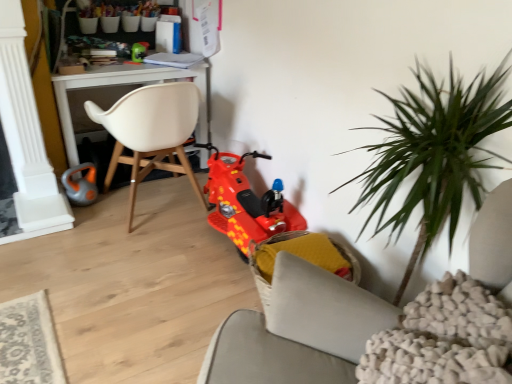
Question: Is orange rubber toy at lower left, arranged as the first toy when viewed from the left, further to camera compared to yellow fabric chair at lower center, which appears as the 1th chair when ordered from the bottom?

Choices:
 (A) no
 (B) yes

Answer: (B)

Question: Is yellow fabric chair at lower center, which appears as the 1th chair when ordered from the bottom, located within orange rubber toy at lower left, arranged as the first toy when viewed from the left?

Choices:
 (A) no
 (B) yes

Answer: (A)

Question: From the image's perspective, is orange rubber toy at lower left, placed as the 2th toy when sorted from top to bottom, on top of yellow fabric chair at lower center, which appears as the 1th chair when ordered from the bottom?

Choices:
 (A) yes
 (B) no

Answer: (A)

Question: Is orange rubber toy at lower left, arranged as the first toy when viewed from the left, oriented towards yellow fabric chair at lower center, the second chair when ordered from top to bottom?

Choices:
 (A) no
 (B) yes

Answer: (B)

Question: Can you confirm if orange rubber toy at lower left, which appears as the 2th toy when ordered from the bottom, is positioned to the right of yellow fabric chair at lower center, the 1th chair from the right?

Choices:
 (A) no
 (B) yes

Answer: (A)

Question: From a real-world perspective, is orange rubber toy at lower left, placed as the 2th toy when sorted from top to bottom, positioned above or below white plastic desk at upper left?

Choices:
 (A) above
 (B) below

Answer: (B)

Question: Would you say orange rubber toy at lower left, placed as the 2th toy when sorted from top to bottom, is to the left or to the right of white plastic desk at upper left in the picture?

Choices:
 (A) left
 (B) right

Answer: (A)

Question: Based on their sizes in the image, would you say orange rubber toy at lower left, arranged as the first toy when viewed from the left, is bigger or smaller than white plastic desk at upper left?

Choices:
 (A) big
 (B) small

Answer: (B)

Question: From the image's perspective, is orange rubber toy at lower left, arranged as the first toy when viewed from the left, located above or below white plastic desk at upper left?

Choices:
 (A) below
 (B) above

Answer: (A)

Question: Based on their positions, is white matte chair at center, arranged as the 2th chair when ordered from the bottom, located to the left or right of shiny plastic scooter at center, the first toy from the bottom?

Choices:
 (A) left
 (B) right

Answer: (A)

Question: Is white matte chair at center, arranged as the 2th chair when ordered from the bottom, bigger or smaller than shiny plastic scooter at center, which appears as the 3th toy when viewed from the left?

Choices:
 (A) small
 (B) big

Answer: (B)

Question: From a real-world perspective, is white matte chair at center, arranged as the 2th chair when ordered from the bottom, physically located above or below shiny plastic scooter at center, the first toy from the bottom?

Choices:
 (A) below
 (B) above

Answer: (B)

Question: In terms of height, does white matte chair at center, marked as the 1th chair in a left-to-right arrangement, look taller or shorter compared to shiny plastic scooter at center, which appears as the 3th toy when viewed from the top?

Choices:
 (A) tall
 (B) short

Answer: (A)

Question: Is shiny plastic scooter at center, which appears as the 3th toy when viewed from the top, bigger or smaller than white plastic desk at upper left?

Choices:
 (A) big
 (B) small

Answer: (B)

Question: Is shiny plastic scooter at center, placed as the first toy when sorted from right to left, spatially inside white plastic desk at upper left, or outside of it?

Choices:
 (A) outside
 (B) inside

Answer: (A)